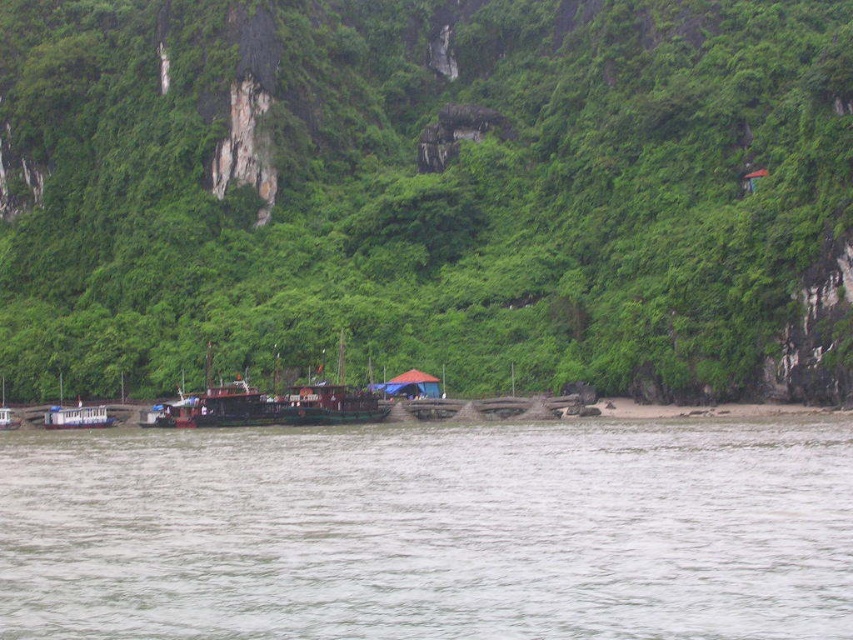
Between point (276, 547) and point (399, 385), which one is positioned behind?

The point (399, 385) is behind.

Is gray matte water at lower center wider than red fabric tent at center?

Yes.

Who is more distant from viewer, (181, 513) or (424, 385)?

The point (424, 385) is behind.

At what (x,y) coordinates should I click in order to perform the action: click on gray matte water at lower center. Please return your answer as a coordinate pair (x, y). The width and height of the screenshot is (853, 640). Looking at the image, I should click on (430, 532).

Is gray matte water at lower center to the left of wooden boat at lower left from the viewer's perspective?

In fact, gray matte water at lower center is to the right of wooden boat at lower left.

Does point (496, 595) lie in front of point (70, 412)?

Yes, it is.

The image size is (853, 640). I want to click on gray matte water at lower center, so click(x=430, y=532).

Between green leafy vegetation at center and gray matte water at lower center, which one is positioned lower?

gray matte water at lower center is lower down.

Does point (271, 177) come behind point (799, 522)?

That is True.

Find the location of a particular element. green leafy vegetation at center is located at coordinates (427, 193).